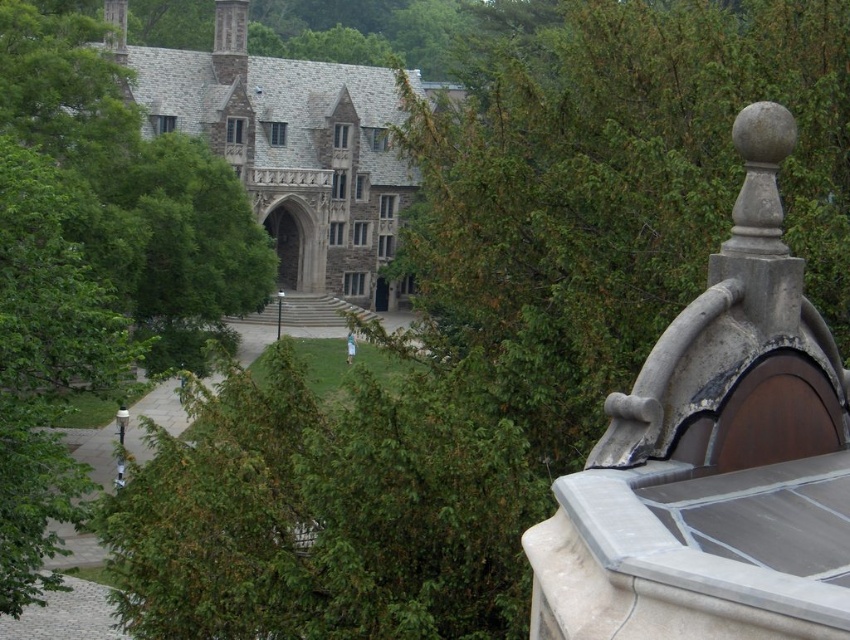
Question: Considering the real-world distances, which object is closest to the gray stone church at upper left?

Choices:
 (A) green leafy tree at upper center
 (B) green leafy tree at center

Answer: (A)

Question: Can you confirm if green leafy tree at upper center is thinner than green leafy tree at center?

Choices:
 (A) no
 (B) yes

Answer: (A)

Question: Among these objects, which one is nearest to the camera?

Choices:
 (A) green leafy tree at upper center
 (B) green leafy tree at center
 (C) gray stone church at upper left

Answer: (A)

Question: Which of these objects is positioned closest to the green leafy tree at upper center?

Choices:
 (A) green leafy tree at center
 (B) gray stone church at upper left

Answer: (B)

Question: Can you confirm if green leafy tree at center is wider than gray stone church at upper left?

Choices:
 (A) yes
 (B) no

Answer: (B)

Question: Does green leafy tree at upper center lie in front of gray stone church at upper left?

Choices:
 (A) no
 (B) yes

Answer: (B)